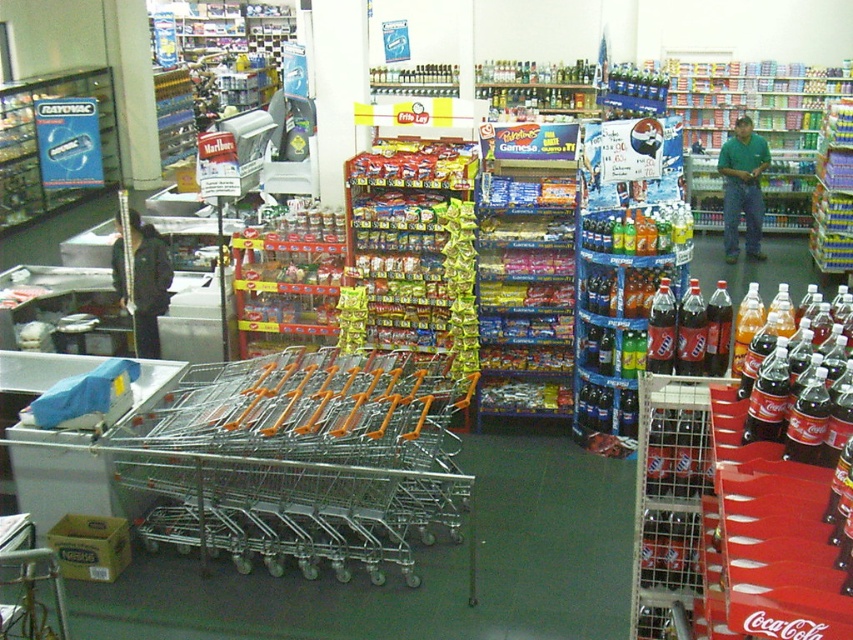
Does silver/metallic shopping cart at center have a lesser width compared to green matte shirt at center?

Incorrect, silver/metallic shopping cart at center's width is not less than green matte shirt at center's.

Which of these two, silver/metallic shopping cart at center or green matte shirt at center, stands taller?

With more height is green matte shirt at center.

Is point (326, 440) farther from viewer compared to point (723, 152)?

No, it is not.

Where is `silver/metallic shopping cart at center`? The image size is (853, 640). silver/metallic shopping cart at center is located at coordinates (302, 461).

Does coca-cola plastic bottles at center right have a greater height compared to black fabric jacket at left?

No.

Between point (675, 458) and point (115, 291), which one is positioned in front?

Point (675, 458)

Who is more forward, (746, 490) or (155, 240)?

Point (746, 490) is in front.

Find the location of a particular element. This screenshot has width=853, height=640. coca-cola plastic bottles at center right is located at coordinates (728, 524).

Which is more to the right, silver/metallic shopping cart at center or black fabric jacket at left?

Positioned to the right is silver/metallic shopping cart at center.

Consider the image. Does silver/metallic shopping cart at center have a greater height compared to black fabric jacket at left?

Correct, silver/metallic shopping cart at center is much taller as black fabric jacket at left.

In the scene shown: Measure the distance between point [196,422] and camera.

A distance of 15.68 feet exists between point [196,422] and camera.

Where is `silver/metallic shopping cart at center`? This screenshot has height=640, width=853. silver/metallic shopping cart at center is located at coordinates (302, 461).